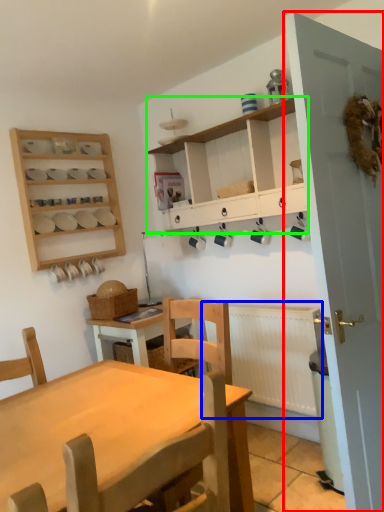
Question: Based on their relative distances, which object is nearer to door (highlighted by a red box)? Choose from radiator (highlighted by a blue box) and cabinetry (highlighted by a green box).

Choices:
 (A) radiator
 (B) cabinetry

Answer: (B)